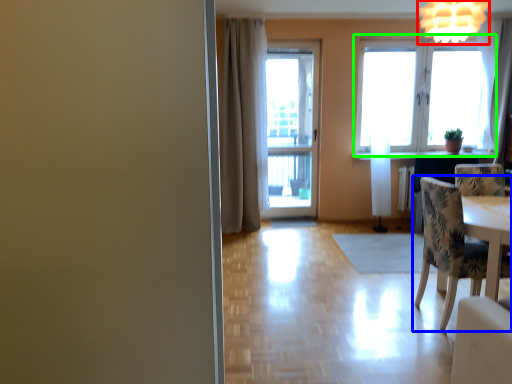
Question: Based on their relative distances, which object is nearer to light fixture (highlighted by a red box)? Choose from chair (highlighted by a blue box) and window (highlighted by a green box).

Choices:
 (A) chair
 (B) window

Answer: (A)